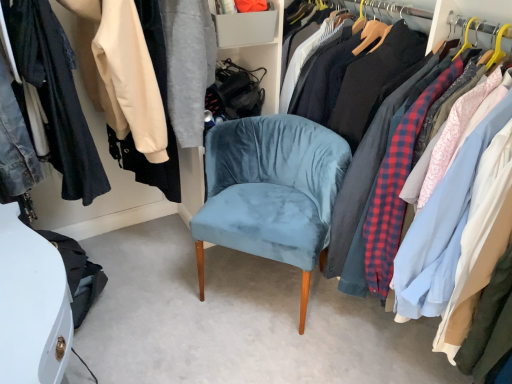
Locate an element on the screen. The height and width of the screenshot is (384, 512). vacant area situated below velvet blue chair at center (from a real-world perspective) is located at coordinates (261, 287).